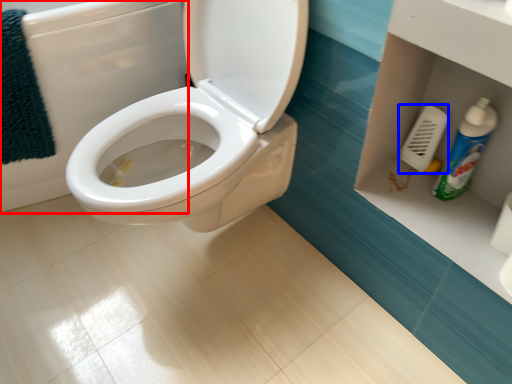
Question: Which object is closer to the camera taking this photo, bath (highlighted by a red box) or towel bar (highlighted by a blue box)?

Choices:
 (A) bath
 (B) towel bar

Answer: (A)